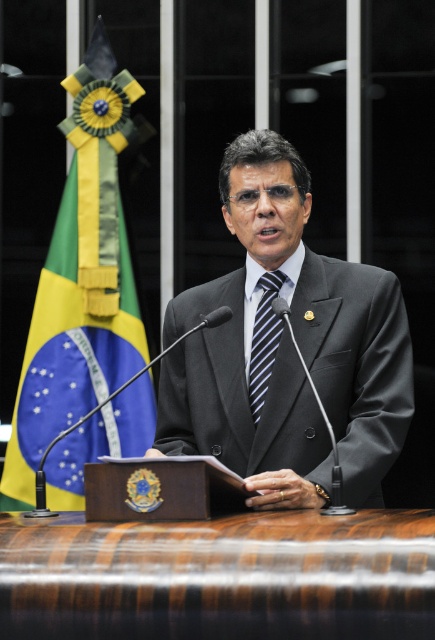
Is point (361, 385) less distant than point (261, 280)?

Yes, it is.

Is dark gray suit at center smaller than blue striped tie at center?

No, dark gray suit at center is not smaller than blue striped tie at center.

Locate an element on the screen. dark gray suit at center is located at coordinates (287, 349).

Does dark gray suit at center have a lesser height compared to green/yellow fabric flag at left?

Yes, dark gray suit at center is shorter than green/yellow fabric flag at left.

Where is `dark gray suit at center`? This screenshot has width=435, height=640. dark gray suit at center is located at coordinates (287, 349).

Between point (86, 364) and point (264, 291), which one is positioned in front?

Point (264, 291) is in front.

Is point (56, 320) closer to camera compared to point (248, 368)?

No, (56, 320) is behind (248, 368).

Who is more distant from viewer, (121, 88) or (263, 310)?

Point (121, 88)

This screenshot has height=640, width=435. I want to click on green/yellow fabric flag at left, so click(x=80, y=276).